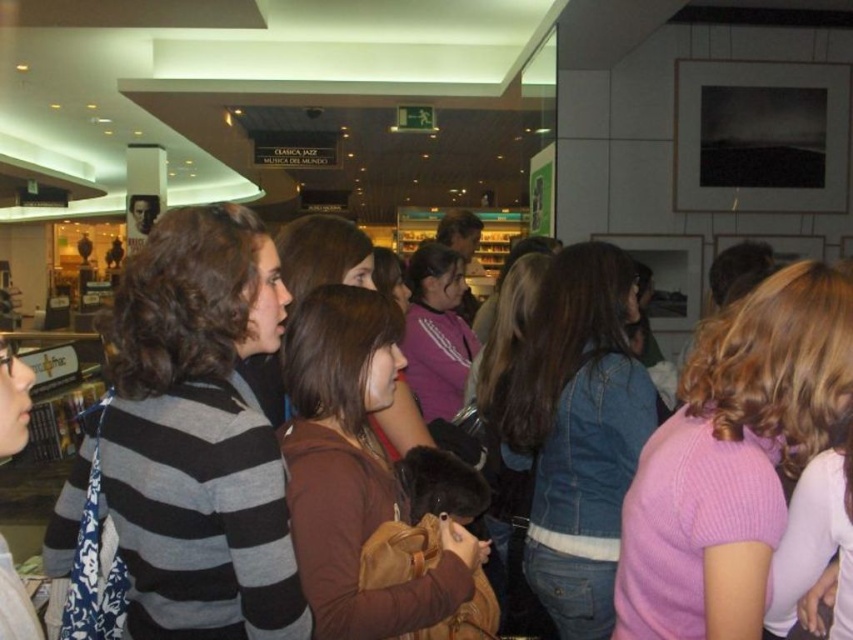
Question: Can you confirm if denim jacket at center is positioned to the left of brown matte sweater at center?

Choices:
 (A) yes
 (B) no

Answer: (B)

Question: Can you confirm if brown matte sweater at center is positioned below purple cotton shirt at center?

Choices:
 (A) no
 (B) yes

Answer: (B)

Question: Which object appears closest to the camera in this image?

Choices:
 (A) brown matte sweater at center
 (B) pink knitted sweater at center
 (C) purple cotton shirt at center

Answer: (B)

Question: Which of the following is the farthest from the observer?

Choices:
 (A) (451, 268)
 (B) (350, 436)
 (C) (413, 406)

Answer: (A)

Question: Among these points, which one is nearest to the camera?

Choices:
 (A) (444, 298)
 (B) (761, 564)
 (C) (338, 260)

Answer: (B)

Question: Does striped sweater at center appear on the right side of purple cotton shirt at center?

Choices:
 (A) yes
 (B) no

Answer: (B)